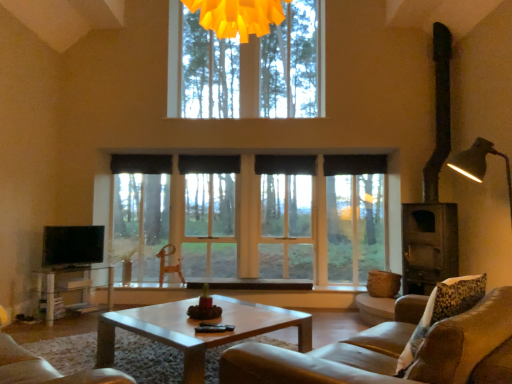
Question: Does flat screen tv at left appear on the right side of black fabric curtain at center, which is the 1th curtain from right to left?

Choices:
 (A) no
 (B) yes

Answer: (A)

Question: From a real-world perspective, is flat screen tv at left physically below black fabric curtain at center, which is the 1th curtain from right to left?

Choices:
 (A) yes
 (B) no

Answer: (A)

Question: Is flat screen tv at left oriented towards black fabric curtain at center, which is the 1th curtain from right to left?

Choices:
 (A) no
 (B) yes

Answer: (A)

Question: Does flat screen tv at left touch black fabric curtain at center, the 4th curtain in the left-to-right sequence?

Choices:
 (A) no
 (B) yes

Answer: (A)

Question: Is flat screen tv at left taller than black fabric curtain at center, which is the 1th curtain from right to left?

Choices:
 (A) yes
 (B) no

Answer: (A)

Question: Is dark brown wood stove at right situated inside black fabric curtain at center, the third curtain positioned from the left, or outside?

Choices:
 (A) inside
 (B) outside

Answer: (B)

Question: Is point (436, 213) positioned closer to the camera than point (309, 155)?

Choices:
 (A) closer
 (B) farther

Answer: (A)

Question: Based on their positions, is dark brown wood stove at right located to the left or right of black fabric curtain at center, the third curtain positioned from the left?

Choices:
 (A) right
 (B) left

Answer: (A)

Question: Is dark brown wood stove at right wider or thinner than black fabric curtain at center, the second curtain viewed from the right?

Choices:
 (A) thin
 (B) wide

Answer: (B)

Question: Considering their positions, is black fabric curtain at center, arranged as the first curtain when viewed from the left, located in front of or behind clear glass window at center?

Choices:
 (A) front
 (B) behind

Answer: (B)

Question: In terms of width, does black fabric curtain at center, positioned as the fourth curtain in right-to-left order, look wider or thinner when compared to clear glass window at center?

Choices:
 (A) thin
 (B) wide

Answer: (A)

Question: Would you say black fabric curtain at center, arranged as the first curtain when viewed from the left, is inside or outside clear glass window at center?

Choices:
 (A) inside
 (B) outside

Answer: (A)

Question: Considering the positions of black fabric curtain at center, arranged as the first curtain when viewed from the left, and clear glass window at center in the image, is black fabric curtain at center, arranged as the first curtain when viewed from the left, bigger or smaller than clear glass window at center?

Choices:
 (A) small
 (B) big

Answer: (A)

Question: Would you say light brown wooden coffee table at center is to the left or to the right of fluffy beige pillow at right in the picture?

Choices:
 (A) left
 (B) right

Answer: (A)

Question: Considering the positions of light brown wooden coffee table at center and fluffy beige pillow at right in the image, is light brown wooden coffee table at center taller or shorter than fluffy beige pillow at right?

Choices:
 (A) short
 (B) tall

Answer: (A)